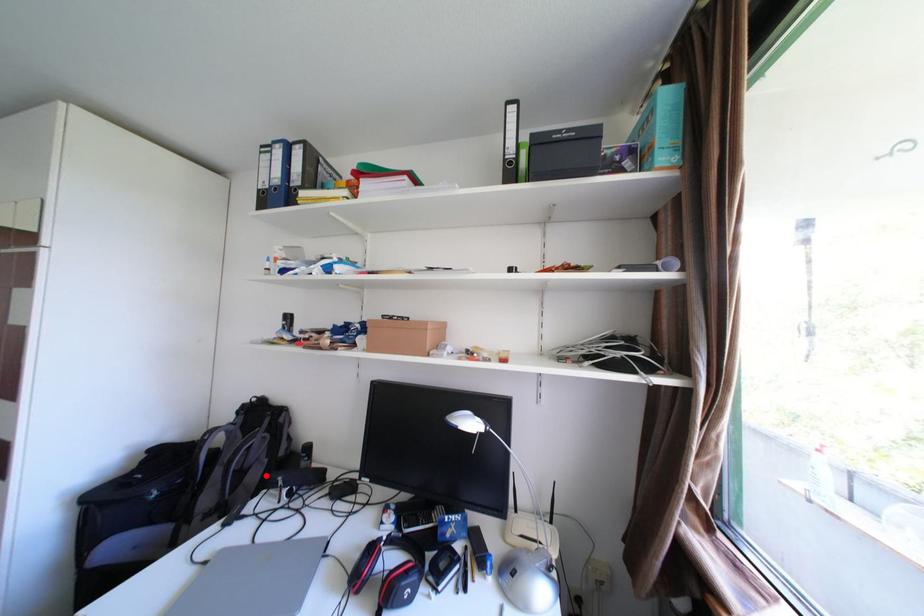
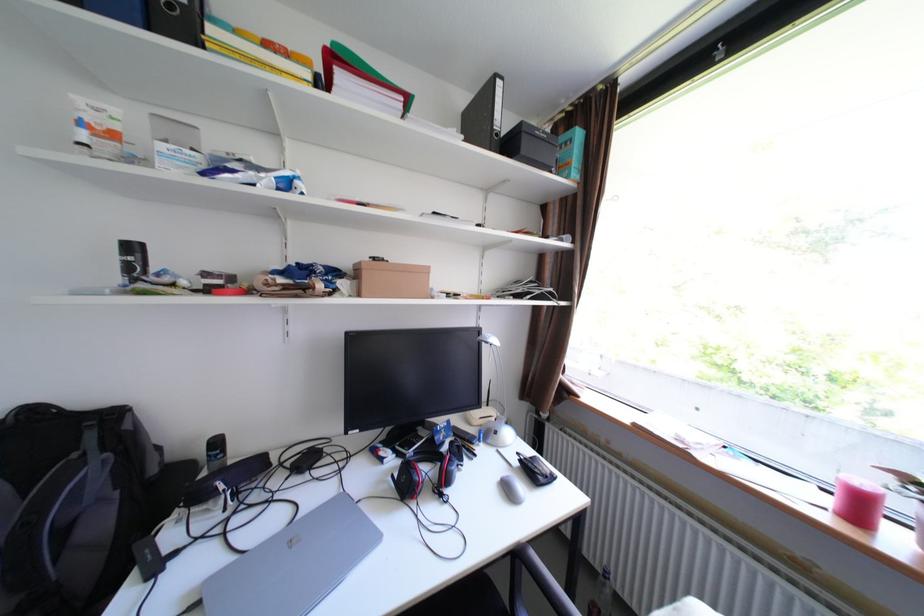
Where in the second image is the point corresponding to the highlighted location from the first image?

(110, 524)